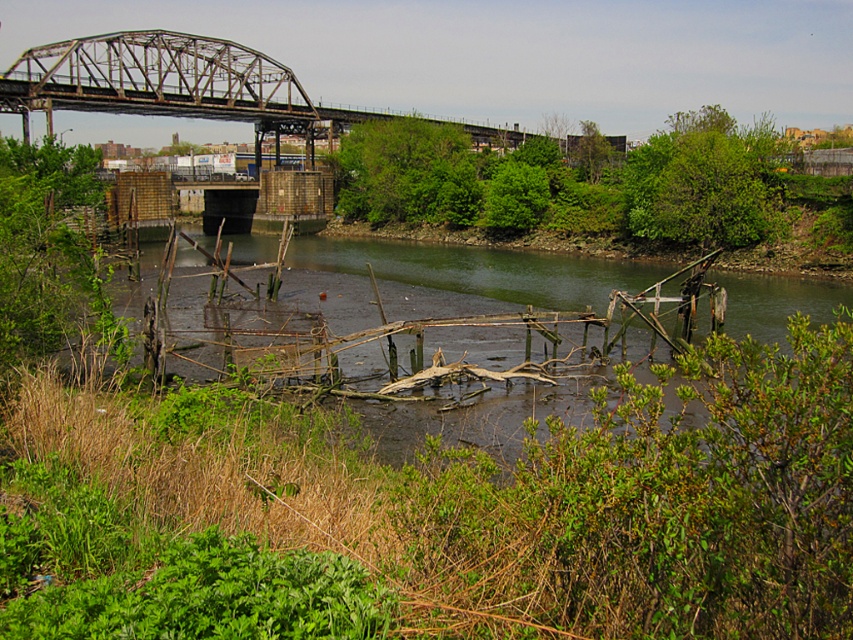
Question: Does green leafy trees at upper center have a smaller size compared to rusty metal bridge at upper center?

Choices:
 (A) yes
 (B) no

Answer: (A)

Question: Is rusty metal bridge at upper center above brown wooden debris at center?

Choices:
 (A) no
 (B) yes

Answer: (B)

Question: In this image, where is green leafy trees at upper center located relative to brown wooden debris at center?

Choices:
 (A) left
 (B) right

Answer: (B)

Question: Considering the real-world distances, which object is farthest from the rusty metal bridge at upper center?

Choices:
 (A) brown wooden debris at center
 (B) green leafy trees at upper center

Answer: (A)

Question: Which of the following is the closest to the observer?

Choices:
 (A) brown wooden debris at center
 (B) green leafy trees at upper center

Answer: (A)

Question: Which of the following is the farthest from the observer?

Choices:
 (A) brown wooden debris at center
 (B) rusty metal bridge at upper center

Answer: (B)